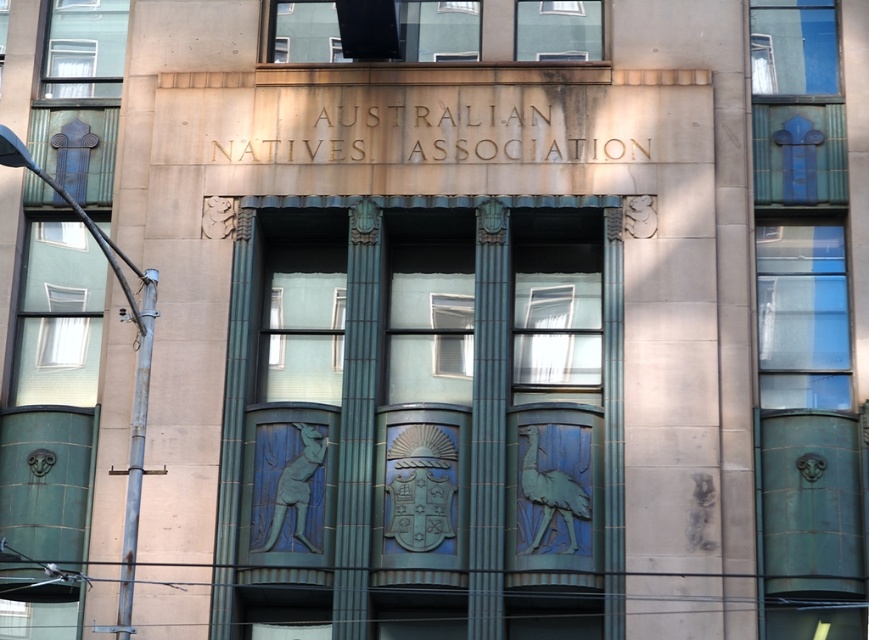
Between transparent glass window at upper center and rusty metal pole at left, which one appears on the left side from the viewer's perspective?

rusty metal pole at left is more to the left.

Who is more forward, (416, 22) or (130, 499)?

Point (130, 499) is in front.

Locate an element on the screen. The image size is (869, 640). transparent glass window at upper center is located at coordinates (439, 29).

Which is more to the right, blue glazed tiles at center or clear glass window at center?

From the viewer's perspective, clear glass window at center appears more on the right side.

Does point (508, 275) come in front of point (551, 396)?

No, it is not.

Where is `blue glazed tiles at center`? This screenshot has width=869, height=640. blue glazed tiles at center is located at coordinates (438, 456).

Describe the element at coordinates (438, 456) in the screenshot. I see `blue glazed tiles at center` at that location.

Between blue glazed tiles at center and rusty metal pole at left, which one has less height?

With less height is rusty metal pole at left.

The width and height of the screenshot is (869, 640). Describe the element at coordinates (438, 456) in the screenshot. I see `blue glazed tiles at center` at that location.

This screenshot has width=869, height=640. Find the location of `blue glazed tiles at center`. blue glazed tiles at center is located at coordinates (438, 456).